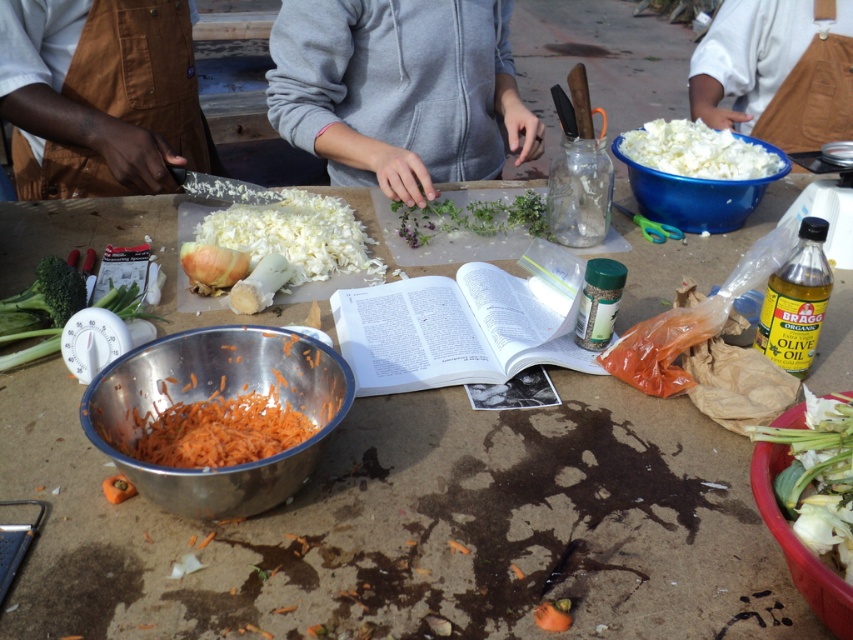
You are organizing the items on the table and want to place the shiny metallic bowl at lower left and the paperback book at center into a storage container. The container can only accommodate one of them. Which item should you choose based on their size?

The shiny metallic bowl at lower left occupies less space than the paperback book at center, so you should choose the shiny metallic bowl at lower left to fit into the storage container.

You are a chef preparing a dish and need to place both the brown canvas apron at left and the white fluffy cabbage at upper right on a shelf. The shelf has limited vertical space. Which object should you place first to ensure both fit vertically?

The brown canvas apron at left is taller than the white fluffy cabbage at upper right. To ensure both fit vertically on the shelf with limited space, place the taller brown canvas apron at left first, then the shorter white fluffy cabbage at upper right.